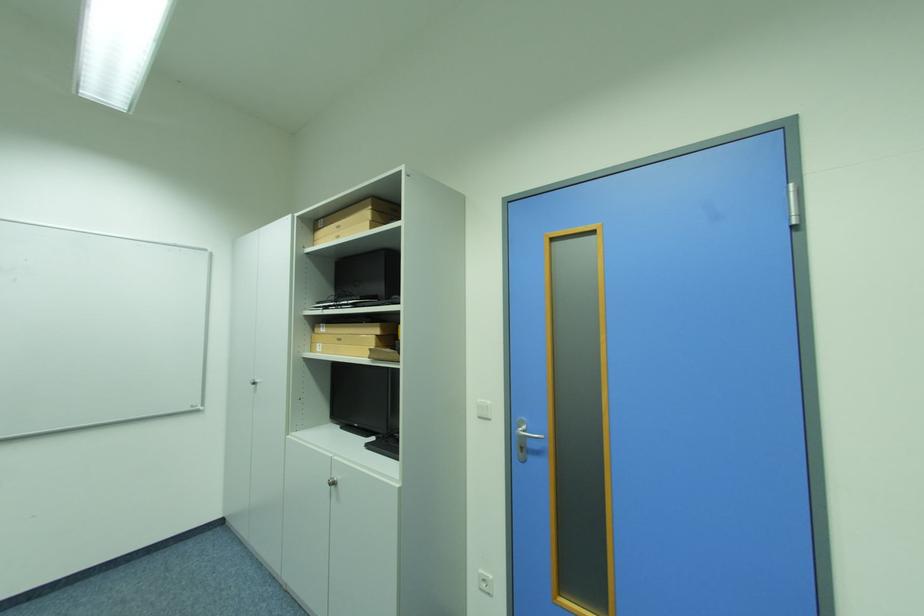
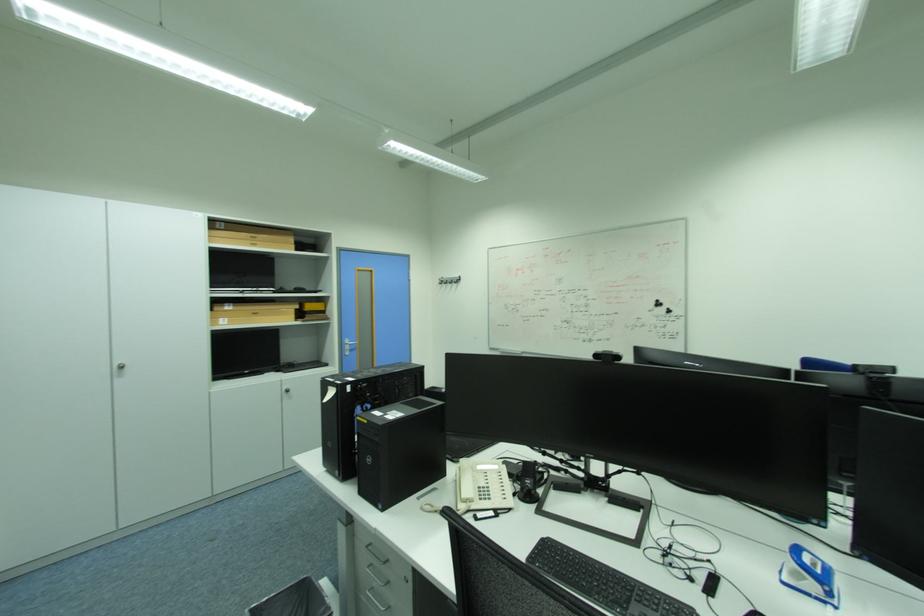
The point at (345, 238) is marked in the first image. Where is the corresponding point in the second image?

(261, 246)